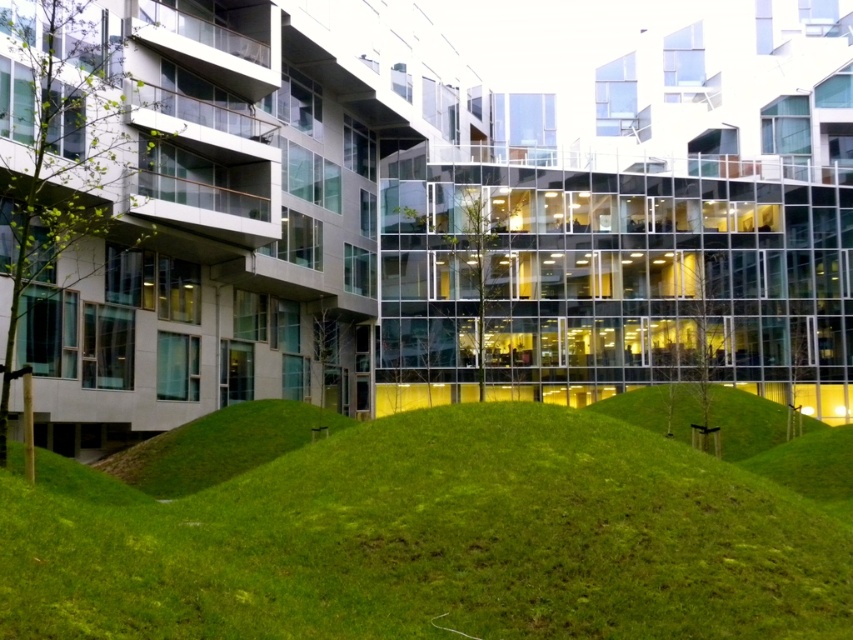
Question: Among these points, which one is farthest from the camera?

Choices:
 (A) (454, 557)
 (B) (196, 472)

Answer: (B)

Question: Which of the following is the farthest from the observer?

Choices:
 (A) (250, 481)
 (B) (167, 468)

Answer: (B)

Question: Which point is farther to the camera?

Choices:
 (A) (177, 545)
 (B) (172, 474)

Answer: (B)

Question: Does green grassy hill at center have a lesser width compared to green grassy mound at center?

Choices:
 (A) yes
 (B) no

Answer: (A)

Question: Can you confirm if green grassy hill at center is wider than green grassy mound at center?

Choices:
 (A) no
 (B) yes

Answer: (A)

Question: Does green grassy hill at center appear on the left side of green grassy mound at center?

Choices:
 (A) no
 (B) yes

Answer: (A)